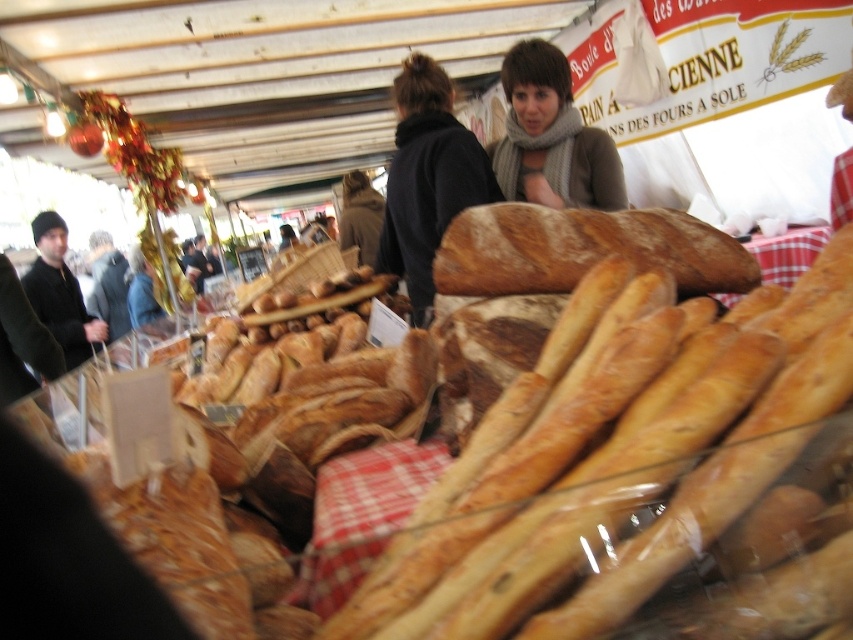
Does point (585, 228) come in front of point (44, 314)?

Yes, it is in front of point (44, 314).

Does golden brown crusty loaf at center have a lesser width compared to black knit hat at left?

Indeed, golden brown crusty loaf at center has a lesser width compared to black knit hat at left.

The width and height of the screenshot is (853, 640). In order to click on golden brown crusty loaf at center in this screenshot , I will do `click(582, 250)`.

Is black woolen sweater at upper center above black knit hat at left?

Yes.

Is black woolen sweater at upper center smaller than black knit hat at left?

Yes, black woolen sweater at upper center is smaller than black knit hat at left.

Is point (432, 186) farther from camera compared to point (64, 234)?

That is False.

Find the location of a particular element. black woolen sweater at upper center is located at coordinates (427, 179).

Locate an element on the screen. The width and height of the screenshot is (853, 640). black woolen sweater at upper center is located at coordinates (427, 179).

Which is in front, point (399, 260) or point (529, 154)?

Point (529, 154) is in front.

This screenshot has height=640, width=853. Find the location of `black woolen sweater at upper center`. black woolen sweater at upper center is located at coordinates (427, 179).

The width and height of the screenshot is (853, 640). I want to click on black woolen sweater at upper center, so click(x=427, y=179).